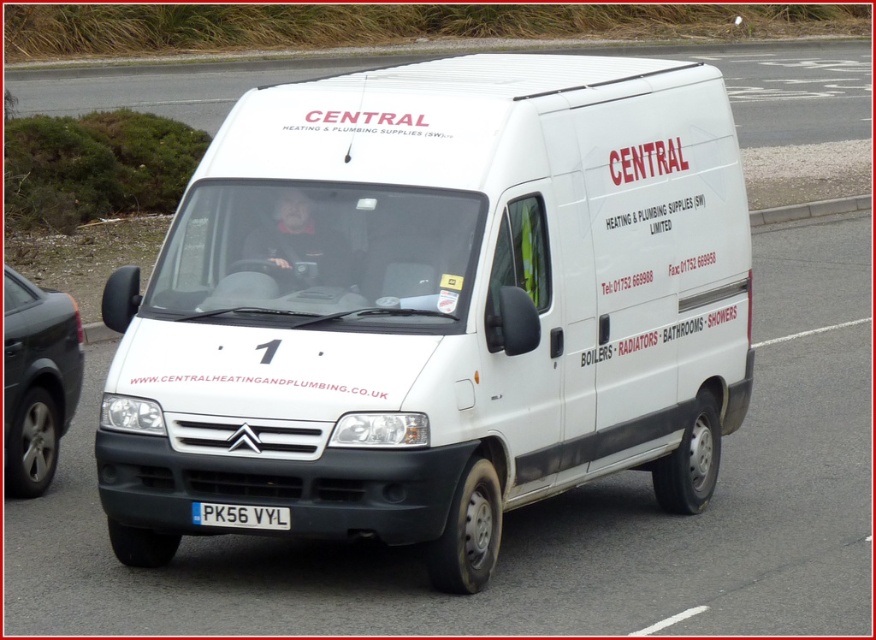
Question: Based on their relative distances, which object is farther from the white plastic license plate at center?

Choices:
 (A) silver metallic van at left
 (B) white matte van at center

Answer: (A)

Question: Which object is farther from the camera taking this photo?

Choices:
 (A) silver metallic van at left
 (B) white matte van at center
 (C) white plastic license plate at center

Answer: (A)

Question: Does white matte van at center have a greater width compared to white plastic license plate at center?

Choices:
 (A) no
 (B) yes

Answer: (B)

Question: Can you confirm if white matte van at center is bigger than white plastic license plate at center?

Choices:
 (A) yes
 (B) no

Answer: (A)

Question: From the image, what is the correct spatial relationship of silver metallic van at left in relation to white plastic license plate at center?

Choices:
 (A) right
 (B) left

Answer: (B)

Question: Based on their relative distances, which object is nearer to the silver metallic van at left?

Choices:
 (A) white plastic license plate at center
 (B) white matte van at center

Answer: (A)